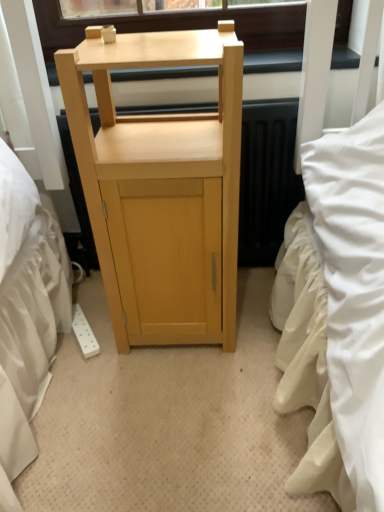
Question: From the image's perspective, would you say light wood cabinet at center is shown under matte wood table at upper center?

Choices:
 (A) no
 (B) yes

Answer: (B)

Question: Considering the relative sizes of light wood cabinet at center and matte wood table at upper center in the image provided, is light wood cabinet at center smaller than matte wood table at upper center?

Choices:
 (A) yes
 (B) no

Answer: (B)

Question: Considering the relative positions of light wood cabinet at center and matte wood table at upper center in the image provided, is light wood cabinet at center in front of matte wood table at upper center?

Choices:
 (A) yes
 (B) no

Answer: (A)

Question: From the image's perspective, is light wood cabinet at center over matte wood table at upper center?

Choices:
 (A) yes
 (B) no

Answer: (B)

Question: Is light wood cabinet at center at the right side of matte wood table at upper center?

Choices:
 (A) no
 (B) yes

Answer: (A)

Question: Is light wood cabinet at center behind matte wood table at upper center?

Choices:
 (A) yes
 (B) no

Answer: (B)

Question: Is light wood cabinet at center surrounded by matte wood table at upper center?

Choices:
 (A) yes
 (B) no

Answer: (B)

Question: From a real-world perspective, is matte wood table at upper center physically below light wood cabinet at center?

Choices:
 (A) yes
 (B) no

Answer: (B)

Question: Considering the relative positions of matte wood table at upper center and light wood cabinet at center in the image provided, is matte wood table at upper center to the left of light wood cabinet at center from the viewer's perspective?

Choices:
 (A) no
 (B) yes

Answer: (A)

Question: Considering the relative positions of matte wood table at upper center and light wood cabinet at center in the image provided, is matte wood table at upper center behind light wood cabinet at center?

Choices:
 (A) yes
 (B) no

Answer: (A)

Question: Considering the relative sizes of matte wood table at upper center and light wood cabinet at center in the image provided, is matte wood table at upper center taller than light wood cabinet at center?

Choices:
 (A) yes
 (B) no

Answer: (B)

Question: Can we say matte wood table at upper center lies outside light wood cabinet at center?

Choices:
 (A) yes
 (B) no

Answer: (A)

Question: Looking at their shapes, would you say matte wood table at upper center is wider or thinner than light wood cabinet at center?

Choices:
 (A) thin
 (B) wide

Answer: (A)